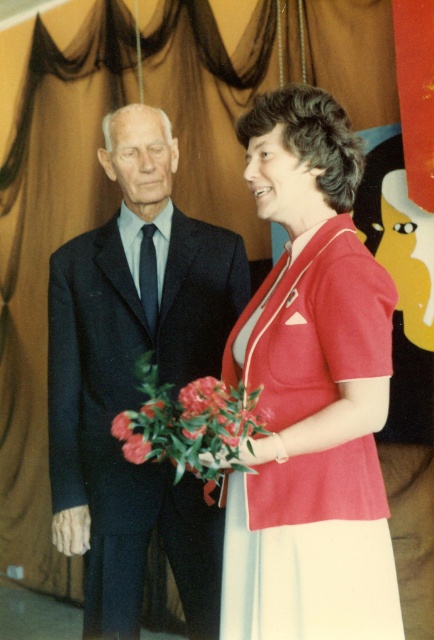
You are a photographer who needs to adjust the lighting so that the matte red dress at center and the fluffy pink rose at center are both well lit. Which object should you move closer to the light source to ensure both are properly illuminated without moving either object?

The fluffy pink rose at center should be moved closer to the light source because the matte red dress at center is positioned on the right side of it, meaning the rose is farther from the light. Moving the rose closer would balance their exposure.

You are a photographer setting up for a portrait. You need to ensure that the matte red dress at center and the vivid pink petals at lower left are both visible in the frame. Given their sizes, which object should you focus on to ensure both are in focus without adjusting the camera settings?

The matte red dress at center is larger in size than the vivid pink petals at lower left, so focusing on the matte red dress at center would ensure both are in focus since it is the larger object.

You are a photographer at a formal event. You notice the matte red dress at center and the fluffy pink rose at center in your frame. Which object is positioned higher in the image?

The fluffy pink rose at center is positioned higher than the matte red dress at center.